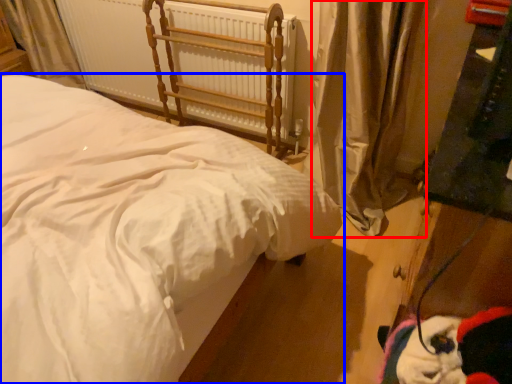
Question: Which point is closer to the camera, curtain (highlighted by a red box) or bed (highlighted by a blue box)?

Choices:
 (A) curtain
 (B) bed

Answer: (B)